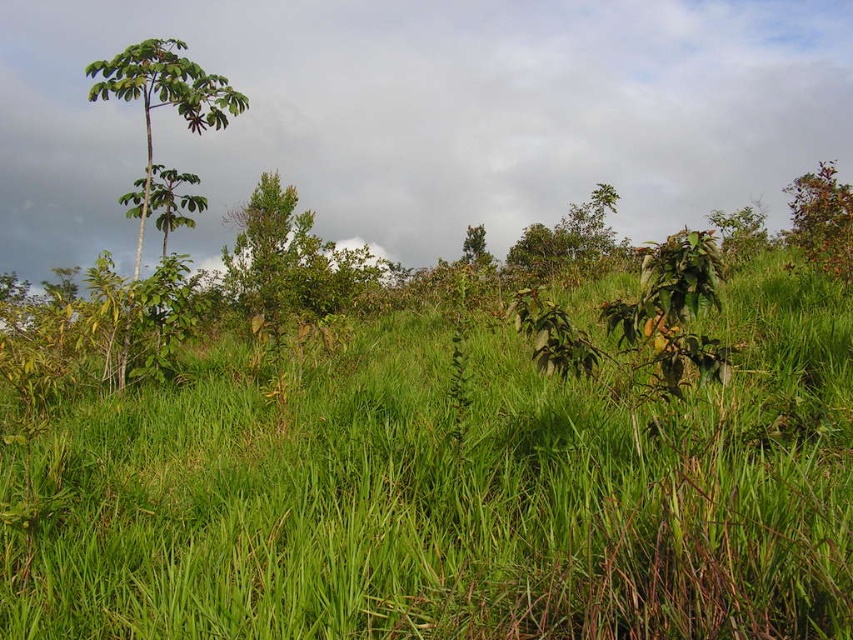
Question: Can you confirm if green grassy at center is smaller than green leafy tree at left?

Choices:
 (A) yes
 (B) no

Answer: (A)

Question: Which is farther from the green grassy at center?

Choices:
 (A) green leafy shrub at upper right
 (B) green leafy tree at left

Answer: (A)

Question: Is green leafy tree at left further to camera compared to green leafy shrub at upper right?

Choices:
 (A) no
 (B) yes

Answer: (A)

Question: Which of the following is the farthest from the observer?

Choices:
 (A) (236, 108)
 (B) (795, 189)
 (C) (845, 612)

Answer: (B)

Question: From the image, what is the correct spatial relationship of green grassy at center in relation to green leafy shrub at upper right?

Choices:
 (A) below
 (B) above

Answer: (A)

Question: Which of the following is the closest to the observer?

Choices:
 (A) (831, 228)
 (B) (178, 65)
 (C) (323, 509)

Answer: (C)